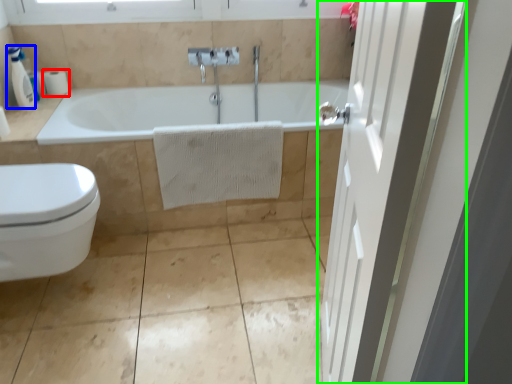
Question: Estimate the real-world distances between objects in this image. Which object is closer to toilet paper (highlighted by a red box), soap dispenser (highlighted by a blue box) or door (highlighted by a green box)?

Choices:
 (A) soap dispenser
 (B) door

Answer: (A)